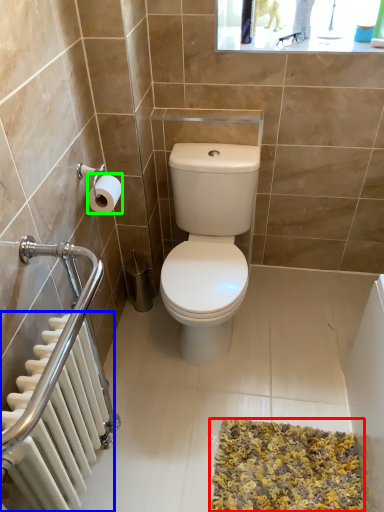
Question: Estimate the real-world distances between objects in this image. Which object is closer to bath mat (highlighted by a red box), radiator (highlighted by a blue box) or toilet paper (highlighted by a green box)?

Choices:
 (A) radiator
 (B) toilet paper

Answer: (A)